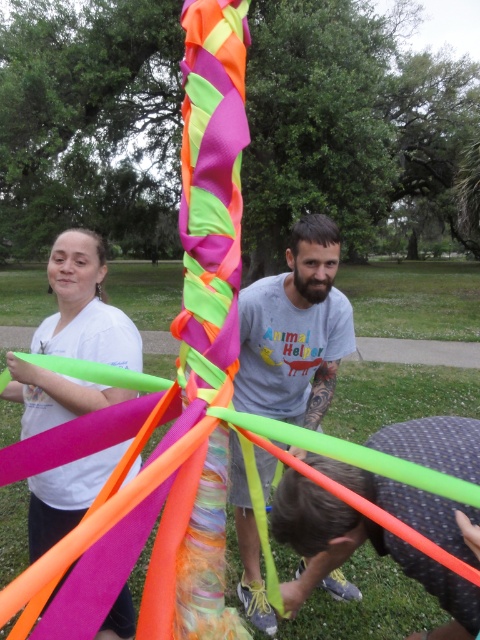
Based on the photo, can you confirm if neon fabric ribbon at center is smaller than neon green plastic hoop at lower center?

Indeed, neon fabric ribbon at center has a smaller size compared to neon green plastic hoop at lower center.

Can you confirm if neon fabric ribbon at center is bigger than neon green plastic hoop at lower center?

No, neon fabric ribbon at center is not bigger than neon green plastic hoop at lower center.

Where is `neon fabric ribbon at center`? The width and height of the screenshot is (480, 640). neon fabric ribbon at center is located at coordinates (178, 369).

Locate an element on the screen. Image resolution: width=480 pixels, height=640 pixels. neon fabric ribbon at center is located at coordinates (178, 369).

Who is taller, neon fabric ribbon at center or matte gray t-shirt at center?

With more height is matte gray t-shirt at center.

Which is in front, point (164, 608) or point (263, 612)?

Point (164, 608) is more forward.

Is point (187, 502) farther from viewer compared to point (262, 392)?

No, (187, 502) is closer to viewer.

At what (x,y) coordinates should I click in order to perform the action: click on neon fabric ribbon at center. Please return your answer as a coordinate pair (x, y). The width and height of the screenshot is (480, 640). Looking at the image, I should click on (178, 369).

Who is taller, matte white shirt at upper left or neon green plastic hoop at lower center?

Standing taller between the two is matte white shirt at upper left.

Is matte white shirt at upper left smaller than neon green plastic hoop at lower center?

Incorrect, matte white shirt at upper left is not smaller in size than neon green plastic hoop at lower center.

Locate an element on the screen. This screenshot has height=640, width=480. matte white shirt at upper left is located at coordinates (84, 307).